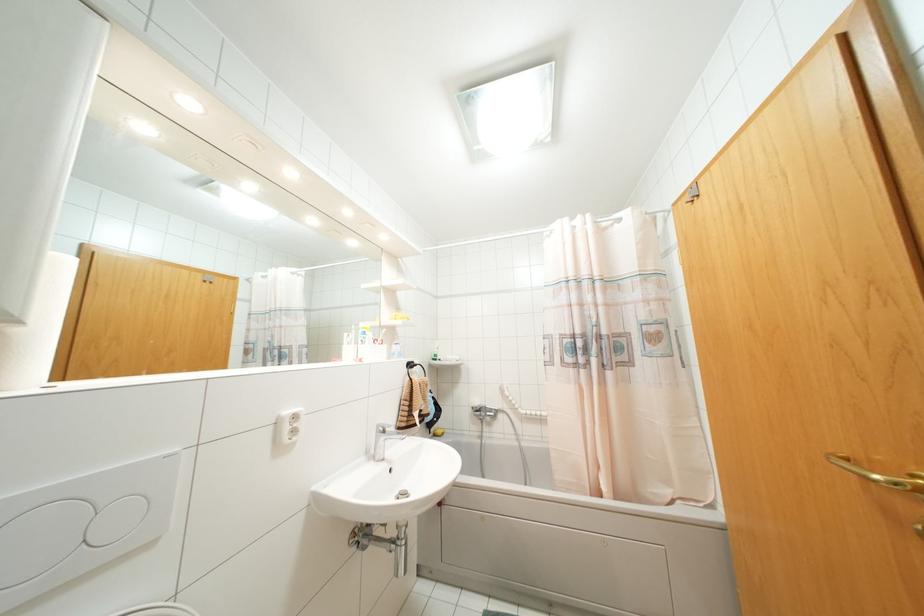
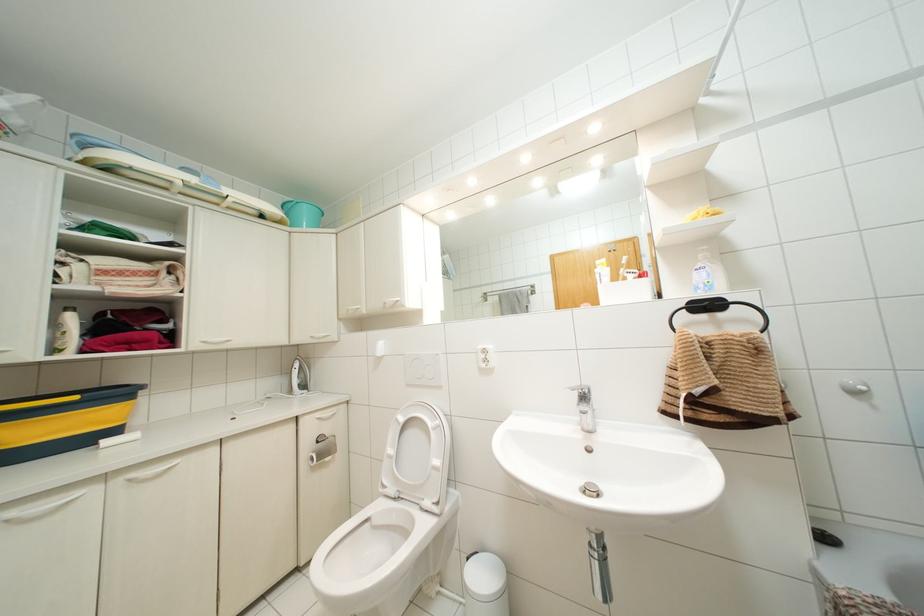
Find the pixel in the second image that matches (383,431) in the first image.

(584, 395)